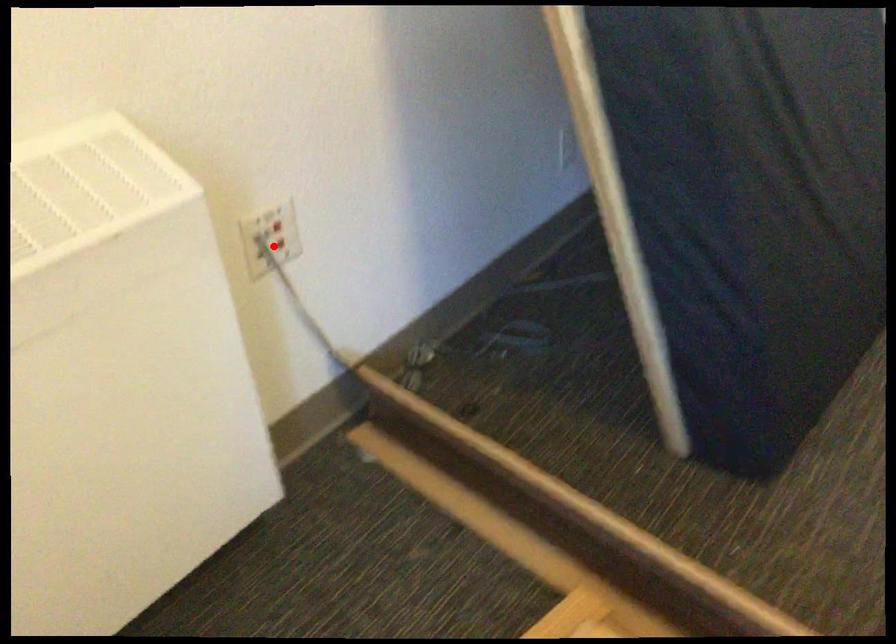
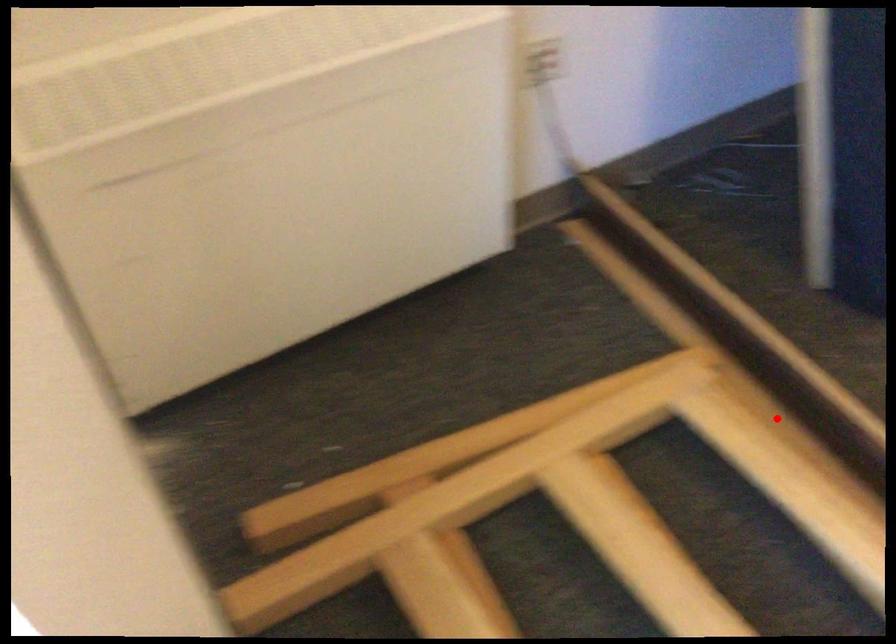
I am providing you with two images of the same scene from different viewpoints. A red point is marked on the first image and another point is marked on the second image. Does the point marked in image1 correspond to the same location as the one in image2?

No